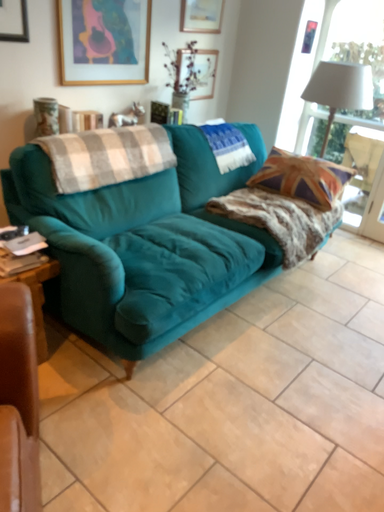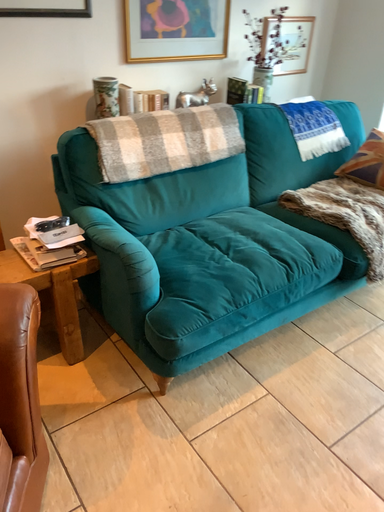
Question: How did the camera likely rotate when shooting the video?

Choices:
 (A) rotated right
 (B) rotated left

Answer: (B)